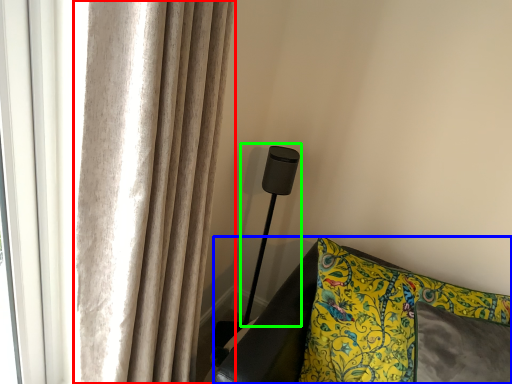
Question: Estimate the real-world distances between objects in this image. Which object is closer to curtain (highlighted by a red box), furniture (highlighted by a blue box) or table lamp (highlighted by a green box)?

Choices:
 (A) furniture
 (B) table lamp

Answer: (A)